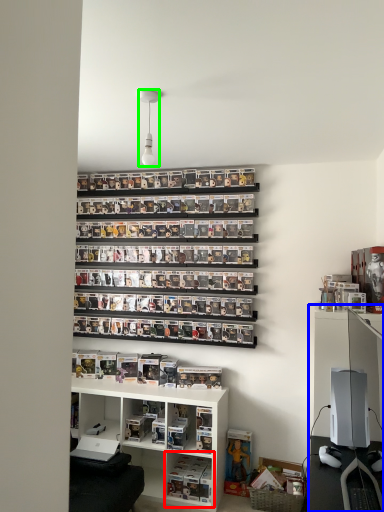
Question: Estimate the real-world distances between objects in this image. Which object is closer to shelf (highlighted by a red box), entertainment center (highlighted by a blue box) or light fixture (highlighted by a green box)?

Choices:
 (A) entertainment center
 (B) light fixture

Answer: (A)